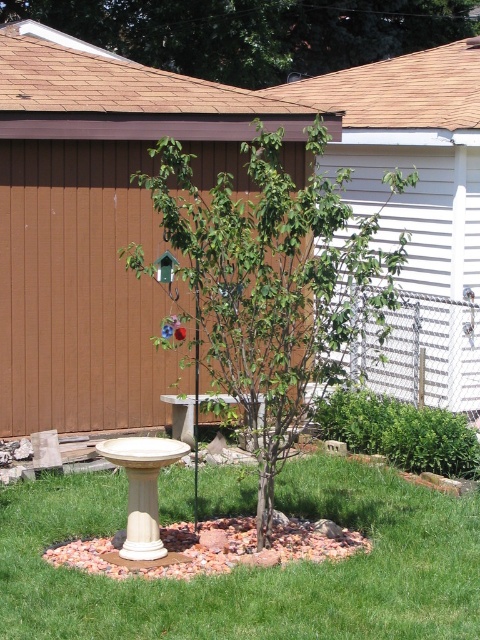
Between green grass at center and green leafy tree at upper center, which one appears on the left side from the viewer's perspective?

green grass at center is more to the left.

Can you confirm if green grass at center is thinner than green leafy tree at upper center?

No.

I want to click on green grass at center, so click(x=252, y=568).

Identify the location of green matte tree at center. (272, 288).

Which is in front, point (242, 276) or point (335, 61)?

Point (242, 276) is in front.

Is point (238, 200) in front of point (325, 58)?

Yes, point (238, 200) is in front of point (325, 58).

The height and width of the screenshot is (640, 480). What are the coordinates of `green matte tree at center` in the screenshot? It's located at point(272,288).

Is green grass at center to the left of green matte tree at center from the viewer's perspective?

Correct, you'll find green grass at center to the left of green matte tree at center.

Is green grass at center positioned in front of green matte tree at center?

Yes, green grass at center is in front of green matte tree at center.

Is point (319, 472) positioned before point (131, 257)?

No, it is not.

Locate an element on the screen. green grass at center is located at coordinates (252, 568).